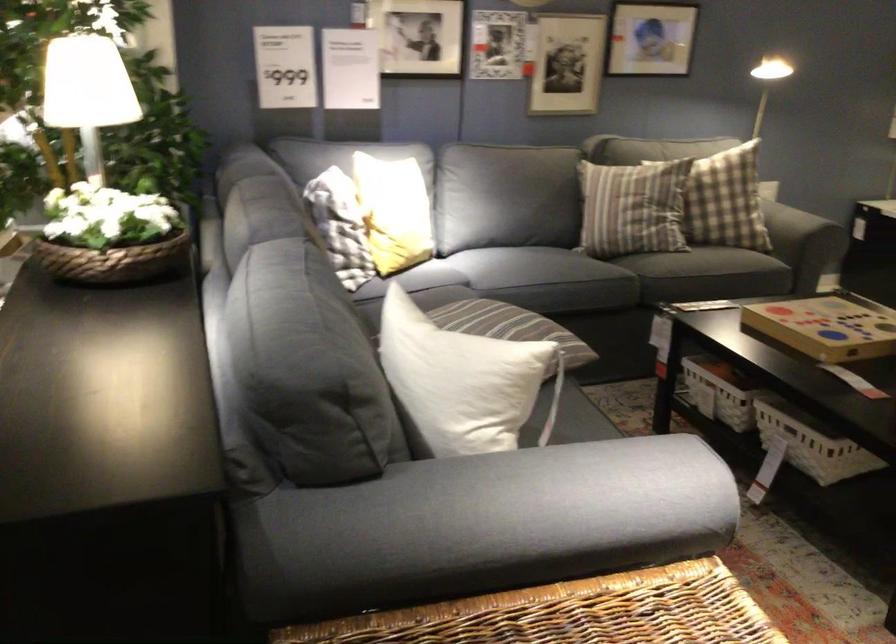
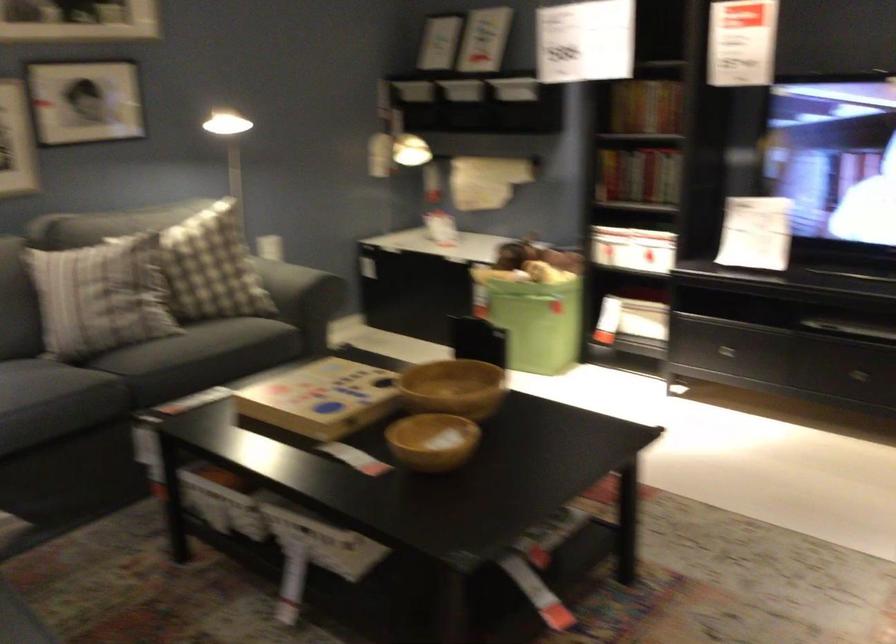
Where in the second image is the point corresponding to (x=650, y=199) from the first image?

(99, 296)